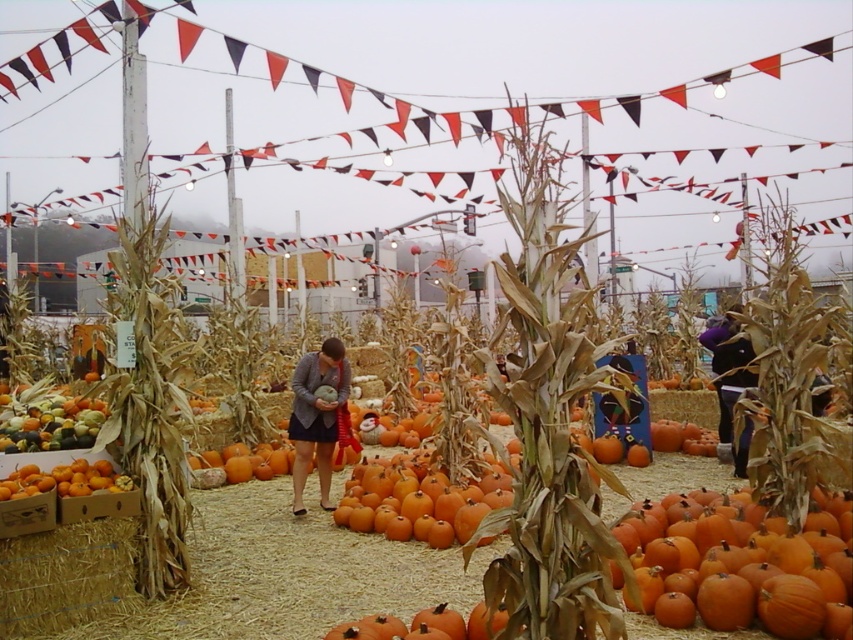
Is point (337, 394) farther from camera compared to point (370, 632)?

Yes, it is behind point (370, 632).

Who is positioned more to the right, matte gray sweater at center or orange matte pumpkin at lower center?

From the viewer's perspective, orange matte pumpkin at lower center appears more on the right side.

Measure the distance between matte gray sweater at center and camera.

A distance of 23.41 feet exists between matte gray sweater at center and camera.

This screenshot has height=640, width=853. In order to click on matte gray sweater at center in this screenshot , I will do `click(317, 417)`.

Does orange matte pumpkin at center appear on the right side of orange matte pumpkin at lower left?

Correct, you'll find orange matte pumpkin at center to the right of orange matte pumpkin at lower left.

Which is above, orange matte pumpkin at center or orange matte pumpkin at lower left?

orange matte pumpkin at lower left is higher up.

Based on the photo, who is more distant from viewer, [791,600] or [57,493]?

Positioned behind is point [57,493].

Image resolution: width=853 pixels, height=640 pixels. Identify the location of orange matte pumpkin at center. (741, 570).

Who is positioned more to the right, orange matte pumpkin at lower center or orange matte pumpkin at lower left?

From the viewer's perspective, orange matte pumpkin at lower center appears more on the right side.

The image size is (853, 640). I want to click on orange matte pumpkin at lower center, so click(425, 625).